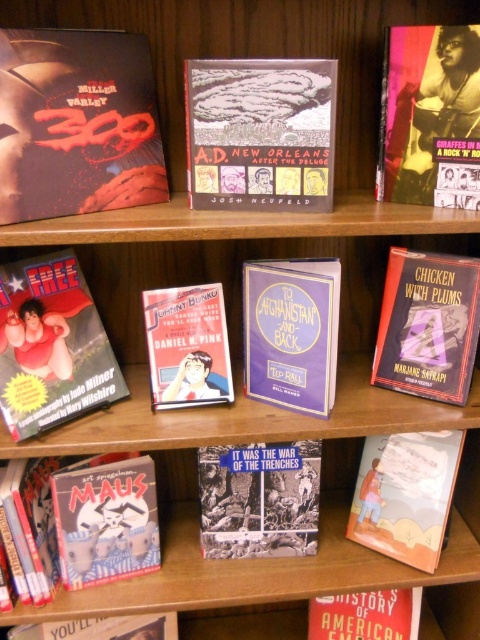
You are standing in front of a wooden bookshelf filled with graphic novels and books. There is a point located at coordinates (146, 83) on the bookshelf. If you want to place a 10 cm wide book exactly at this point, will there be enough space for it?

The point at (146, 83) is 96.46 centimeters away from you. Since the book is only 10 cm wide, there is definitely enough space to place it at that point.

You are standing in front of the wooden bookshelf and want to reach the matte black comic book at upper left. If your arm can extend 30 inches, can you reach it?

The matte black comic book at upper left is 32.21 inches away from you. Since your arm can only extend 30 inches, you cannot reach it without moving closer.